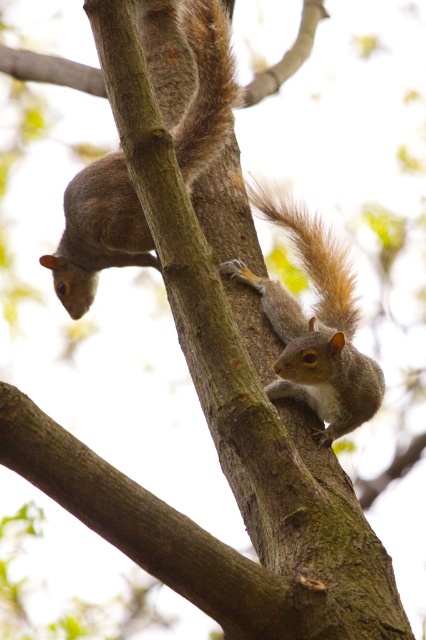
You are observing two squirrels on the same tree branch. You notice the gray fur squirrel at center and the gray furry squirrel at center. Which one has a greater height?

The gray fur squirrel at center is much taller than the gray furry squirrel at center.

You are a photographer trying to capture a closeup of the gray fur squirrel at center. You have a zoom lens that can focus on a specific point. The point you want to focus on is marked as point (97, 232). Is this point on the gray fur squirrel at center?

Yes, the point (97, 232) is on the gray fur squirrel at center, so focusing there will capture the squirrel clearly.

You are a wildlife photographer trying to capture the squirrels on the tree branch. If you want to ensure both the gray furry squirrel at center and the fuzzy brown tail at right are fully visible in your photo, which object should you focus on to avoid cropping either of them?

You should focus on the gray furry squirrel at center because its width is larger than the fuzzy brown tail at right, so ensuring the squirrel fits will automatically include the tail in the frame.